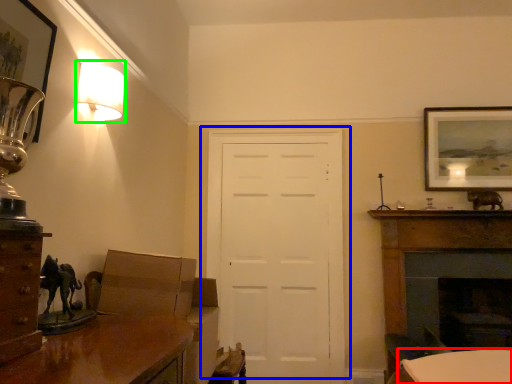
Question: Based on their relative distances, which object is farther from table (highlighted by a red box)? Choose from door (highlighted by a blue box) and lamp (highlighted by a green box).

Choices:
 (A) door
 (B) lamp

Answer: (B)